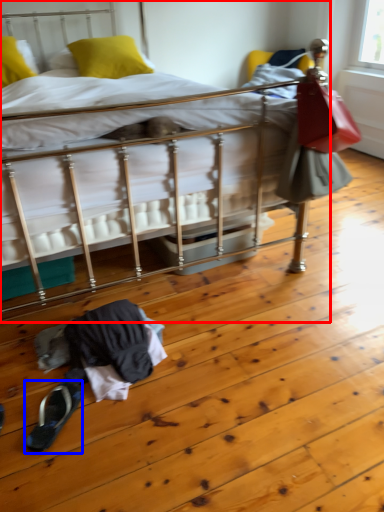
Question: Which of the following is the farthest to the observer, bed (highlighted by a red box) or footwear (highlighted by a blue box)?

Choices:
 (A) bed
 (B) footwear

Answer: (B)